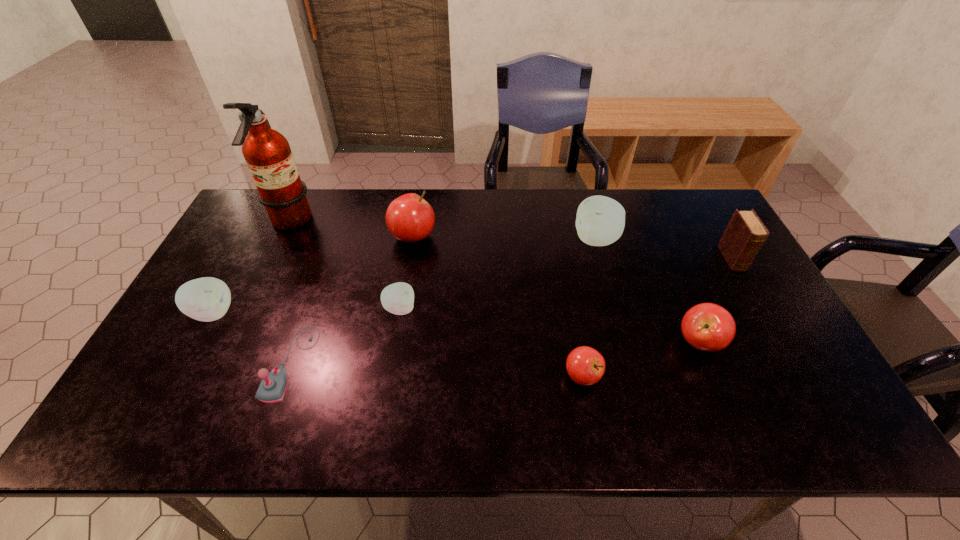
Identify the location of blank space located on the right of the leftmost apple. This screenshot has width=960, height=540. pyautogui.click(x=377, y=313).

This screenshot has width=960, height=540. I want to click on free space located on the left of the rightmost apple, so click(x=649, y=342).

The width and height of the screenshot is (960, 540). I want to click on free region located 0.240m on the back of the second white apple from right to left, so pos(411,240).

The width and height of the screenshot is (960, 540). What are the coordinates of `free region located on the back of the smallest red apple` in the screenshot? It's located at (575, 334).

At what (x,y) coordinates should I click in order to perform the action: click on free space located 0.280m on the back of the gray joystick. Please return your answer as a coordinate pair (x, y). This screenshot has width=960, height=540. Looking at the image, I should click on (329, 254).

Identify the location of fire extinguisher at the far edge. (267, 152).

Image resolution: width=960 pixels, height=540 pixels. I want to click on object that is at the near edge, so click(272, 388).

Locate an element on the screen. This screenshot has height=540, width=960. fire extinguisher positioned at the left edge is located at coordinates (267, 152).

Identify the location of apple located at the left edge. (207, 299).

Find the location of a particular element. object at the right edge is located at coordinates (745, 234).